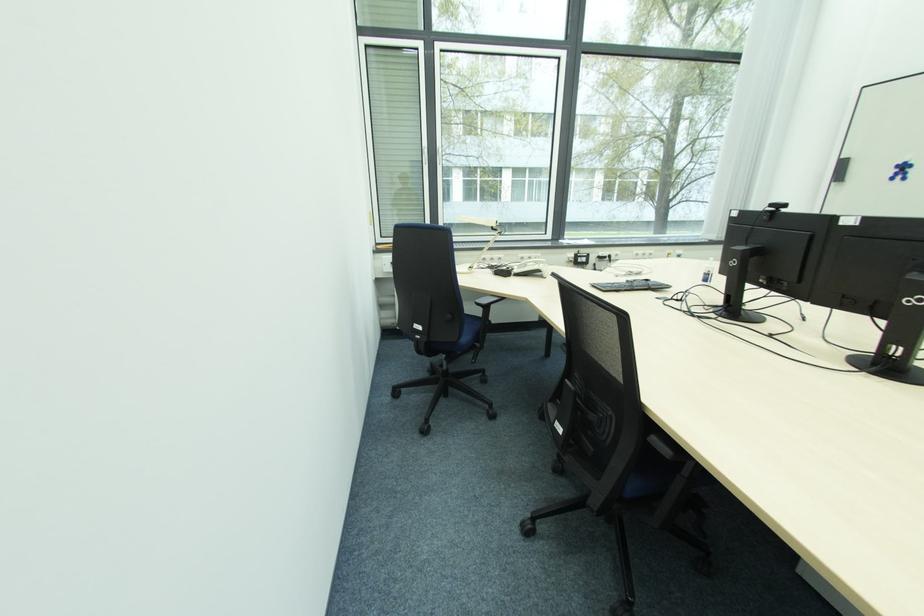
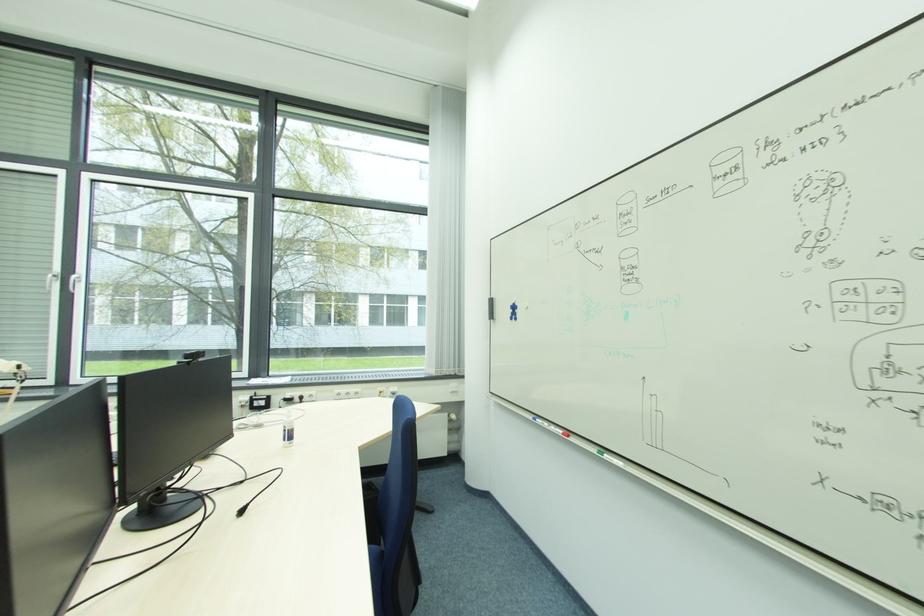
Question: The images are taken continuously from a first-person perspective. In which direction are you moving?

Choices:
 (A) Left
 (B) Right
 (C) Forward
 (D) Backward

Answer: (B)